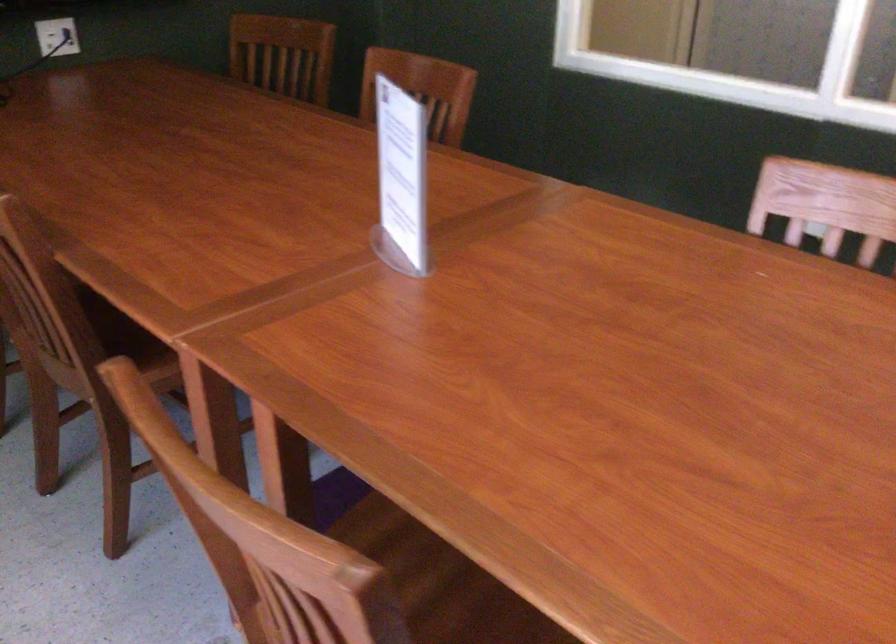
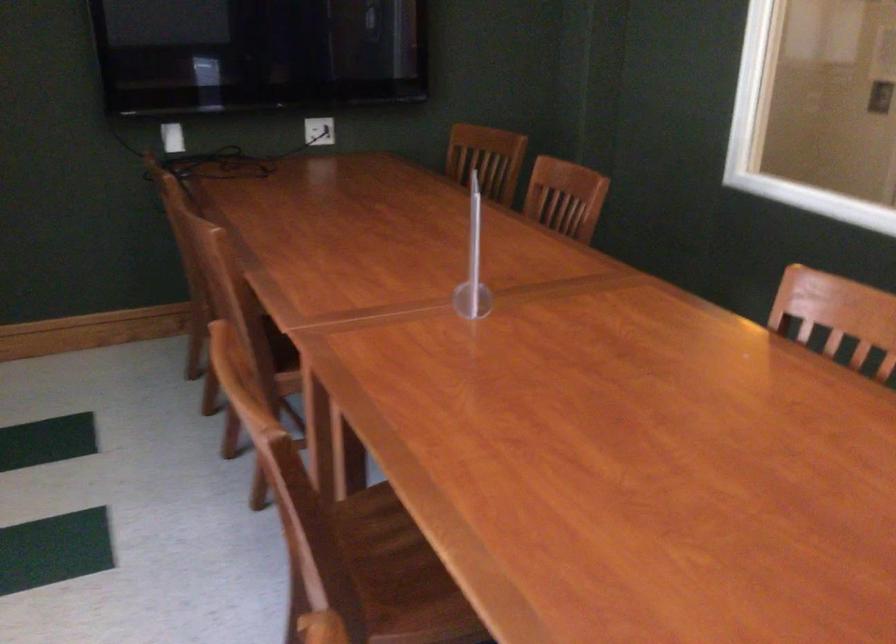
Where in the second image is the point corresponding to point (358, 196) from the first image?

(472, 263)